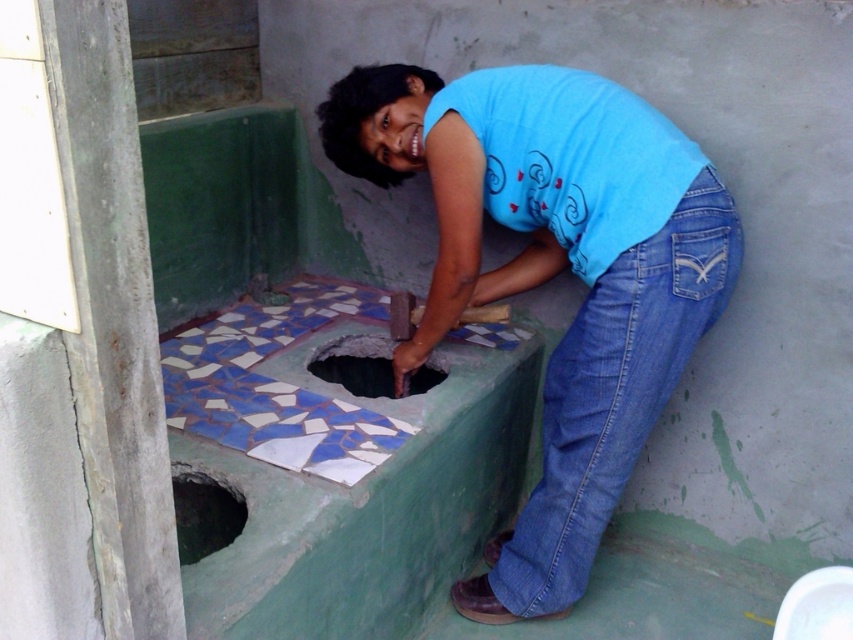
Does blue cotton shirt at center have a greater width compared to denim at lower right?

Correct, the width of blue cotton shirt at center exceeds that of denim at lower right.

Is point (728, 260) behind point (589, 525)?

No, it is not.

Locate an element on the screen. This screenshot has width=853, height=640. blue cotton shirt at center is located at coordinates (554, 273).

Which is behind, point (590, 540) or point (412, 392)?

The point (412, 392) is behind.

Measure the distance from blue cotton shirt at center to smooth concrete hole at center.

A distance of 14.93 inches exists between blue cotton shirt at center and smooth concrete hole at center.

Between point (402, 353) and point (335, 368), which one is positioned behind?

The point (335, 368) is more distant.

At what (x,y) coordinates should I click in order to perform the action: click on blue cotton shirt at center. Please return your answer as a coordinate pair (x, y). The image size is (853, 640). Looking at the image, I should click on (554, 273).

Does denim at lower right have a lesser height compared to smooth concrete hole at center?

No.

From the picture: Does denim at lower right appear on the left side of smooth concrete hole at center?

Incorrect, denim at lower right is not on the left side of smooth concrete hole at center.

Does point (659, 269) come behind point (350, 360)?

No, it is in front of (350, 360).

Locate an element on the screen. This screenshot has width=853, height=640. denim at lower right is located at coordinates tap(614, 392).